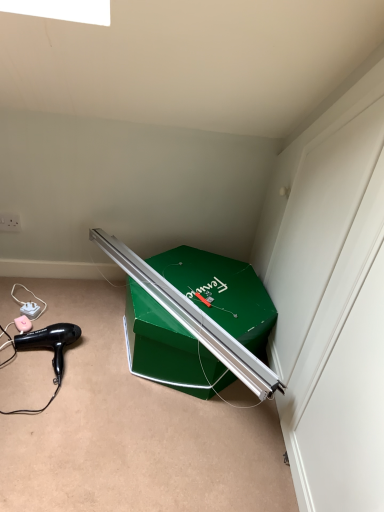
Image resolution: width=384 pixels, height=512 pixels. What do you see at coordinates (222, 292) in the screenshot?
I see `green cardboard box at center` at bounding box center [222, 292].

What are the coordinates of `green cardboard box at center` in the screenshot? It's located at (222, 292).

This screenshot has height=512, width=384. I want to click on black plastic hair dryer at lower left, so click(50, 343).

The height and width of the screenshot is (512, 384). Describe the element at coordinates (50, 343) in the screenshot. I see `black plastic hair dryer at lower left` at that location.

Identify the location of green cardboard box at center. The width and height of the screenshot is (384, 512). (222, 292).

Does black plastic hair dryer at lower left appear on the right side of green cardboard box at center?

No, black plastic hair dryer at lower left is not to the right of green cardboard box at center.

Who is more distant, black plastic hair dryer at lower left or green cardboard box at center?

black plastic hair dryer at lower left is further away from the camera.

Between point (65, 325) and point (226, 318), which one is positioned behind?

The point (65, 325) is more distant.

From the image's perspective, is black plastic hair dryer at lower left located above or below green cardboard box at center?

Clearly, from the image's perspective, black plastic hair dryer at lower left is below green cardboard box at center.

From a real-world perspective, is black plastic hair dryer at lower left physically located above or below green cardboard box at center?

black plastic hair dryer at lower left is below green cardboard box at center.

Based on the photo, does black plastic hair dryer at lower left have a lesser width compared to green cardboard box at center?

Yes, black plastic hair dryer at lower left is thinner than green cardboard box at center.

Who is taller, black plastic hair dryer at lower left or green cardboard box at center?

green cardboard box at center is taller.

Considering the relative sizes of black plastic hair dryer at lower left and green cardboard box at center in the image provided, is black plastic hair dryer at lower left smaller than green cardboard box at center?

Indeed, black plastic hair dryer at lower left has a smaller size compared to green cardboard box at center.

Is black plastic hair dryer at lower left situated inside green cardboard box at center or outside?

black plastic hair dryer at lower left is not inside green cardboard box at center, it's outside.

Would you consider black plastic hair dryer at lower left to be distant from green cardboard box at center?

No, there isn't a large distance between black plastic hair dryer at lower left and green cardboard box at center.

Is black plastic hair dryer at lower left aimed at green cardboard box at center?

No.

What's the angular difference between black plastic hair dryer at lower left and green cardboard box at center's facing directions?

13.4 degrees.

In order to click on box on the right of black plastic hair dryer at lower left in this screenshot , I will do `click(222, 292)`.

Which is more to the right, green cardboard box at center or black plastic hair dryer at lower left?

green cardboard box at center is more to the right.

Which object is further away from the camera, green cardboard box at center or black plastic hair dryer at lower left?

black plastic hair dryer at lower left is more distant.

Is point (258, 324) farther from viewer compared to point (45, 335)?

No, it is in front of (45, 335).

From the image's perspective, is green cardboard box at center on top of black plastic hair dryer at lower left?

Yes, from the image's perspective, green cardboard box at center is above black plastic hair dryer at lower left.

From a real-world perspective, between green cardboard box at center and black plastic hair dryer at lower left, who is vertically higher?

In real-world perspective, green cardboard box at center is above.

Between green cardboard box at center and black plastic hair dryer at lower left, which one has larger width?

Wider between the two is green cardboard box at center.

Consider the image. Between green cardboard box at center and black plastic hair dryer at lower left, which one has less height?

black plastic hair dryer at lower left.

Which of these two, green cardboard box at center or black plastic hair dryer at lower left, is bigger?

Bigger between the two is green cardboard box at center.

Would you say green cardboard box at center contains black plastic hair dryer at lower left?

Definitely not — black plastic hair dryer at lower left is not inside green cardboard box at center.

Are green cardboard box at center and black plastic hair dryer at lower left located far from each other?

No.

Is green cardboard box at center looking in the opposite direction of black plastic hair dryer at lower left?

No, black plastic hair dryer at lower left is not at the back of green cardboard box at center.

Measure the distance from green cardboard box at center to black plastic hair dryer at lower left.

green cardboard box at center and black plastic hair dryer at lower left are 18.13 inches apart from each other.

What are the coordinates of `hair drier behind the green cardboard box at center` in the screenshot? It's located at coord(50,343).

In the image, there is a black plastic hair dryer at lower left. Find the location of `box above it (from the image's perspective)`. box above it (from the image's perspective) is located at coordinates (222, 292).

You are a GUI agent. You are given a task and a screenshot of the screen. Output one action in this format:
    pyautogui.click(x=<x>, y=<y>)
    Task: Click on the hair drier behind the green cardboard box at center
    The image size is (384, 512).
    Given the screenshot: What is the action you would take?
    pyautogui.click(x=50, y=343)